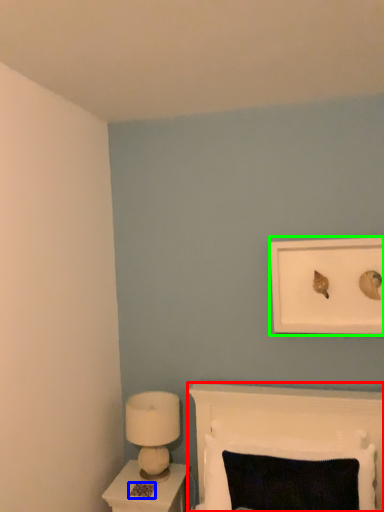
Question: Which object is the farthest from furniture (highlighted by a red box)? Choose among these: footprint (highlighted by a blue box) or picture frame (highlighted by a green box).

Choices:
 (A) footprint
 (B) picture frame

Answer: (A)